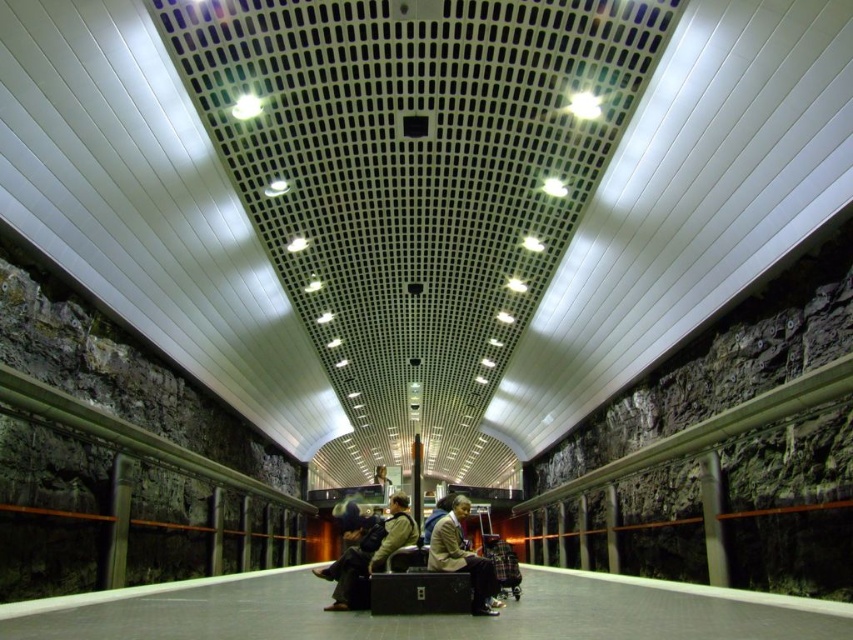
Based on the photo, is dark gray fabric jacket at center bigger than tan leather jacket at center?

Yes, dark gray fabric jacket at center is bigger than tan leather jacket at center.

Does dark gray fabric jacket at center come in front of tan leather jacket at center?

No.

Does point (355, 566) come closer to viewer compared to point (448, 531)?

That is True.

You are a GUI agent. You are given a task and a screenshot of the screen. Output one action in this format:
    pyautogui.click(x=<x>, y=<y>)
    Task: Click on the dark gray fabric jacket at center
    The height and width of the screenshot is (640, 853).
    Given the screenshot: What is the action you would take?
    pyautogui.click(x=366, y=550)